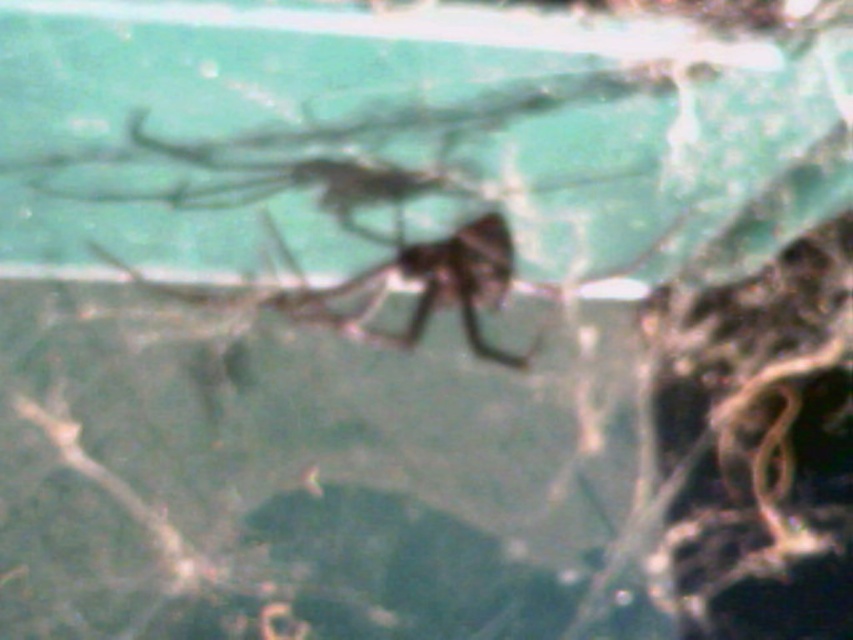
Question: Is shiny black spider at center positioned before shiny brown spider at center?

Choices:
 (A) no
 (B) yes

Answer: (B)

Question: Which object is farther from the camera taking this photo?

Choices:
 (A) shiny black spider at center
 (B) shiny brown spider at center

Answer: (B)

Question: Is shiny black spider at center closer to camera compared to shiny brown spider at center?

Choices:
 (A) yes
 (B) no

Answer: (A)

Question: Does shiny black spider at center appear over shiny brown spider at center?

Choices:
 (A) no
 (B) yes

Answer: (B)